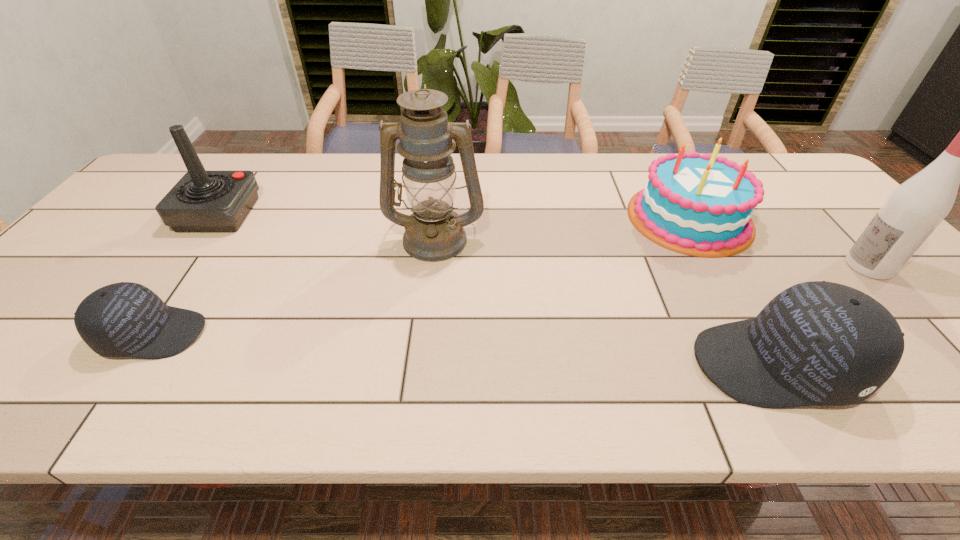
I want to click on free region located at the front of the taller baseball cap where the brim is located, so click(660, 364).

The height and width of the screenshot is (540, 960). I want to click on free space located on the front of the birthday cake, so click(x=772, y=362).

At what (x,y) coordinates should I click in order to perform the action: click on free space located on the label of the alcohol. Please return your answer as a coordinate pair (x, y). This screenshot has width=960, height=540. Looking at the image, I should click on (763, 266).

At what (x,y) coordinates should I click in order to perform the action: click on blank space located 0.400m on the label of the alcohol. Please return your answer as a coordinate pair (x, y). Looking at the image, I should click on (687, 266).

At what (x,y) coordinates should I click in order to perform the action: click on blank space located on the label of the alcohol. Please return your answer as a coordinate pair (x, y). The image size is (960, 540). Looking at the image, I should click on (759, 266).

Find the location of a particular element. vacant space located on the front-facing side of the joystick is located at coordinates point(393,214).

Where is `vacant space positioned on the right of the oil lamp`? Image resolution: width=960 pixels, height=540 pixels. vacant space positioned on the right of the oil lamp is located at coordinates pyautogui.click(x=607, y=238).

I want to click on object present at the far edge, so click(700, 205).

This screenshot has width=960, height=540. In order to click on object that is at the right edge in this screenshot , I will do `click(915, 208)`.

The image size is (960, 540). What are the coordinates of `free space at the far edge of the desktop` in the screenshot? It's located at (568, 189).